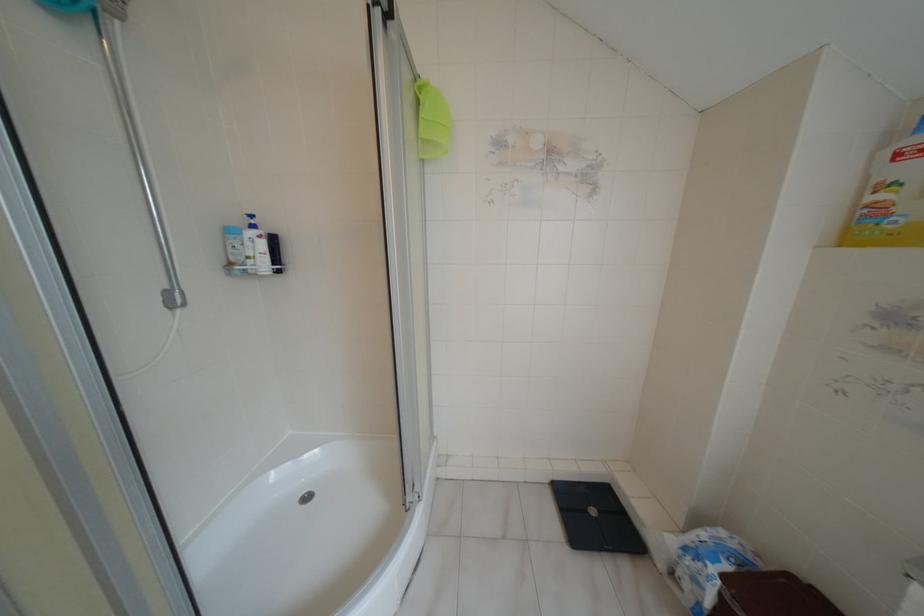
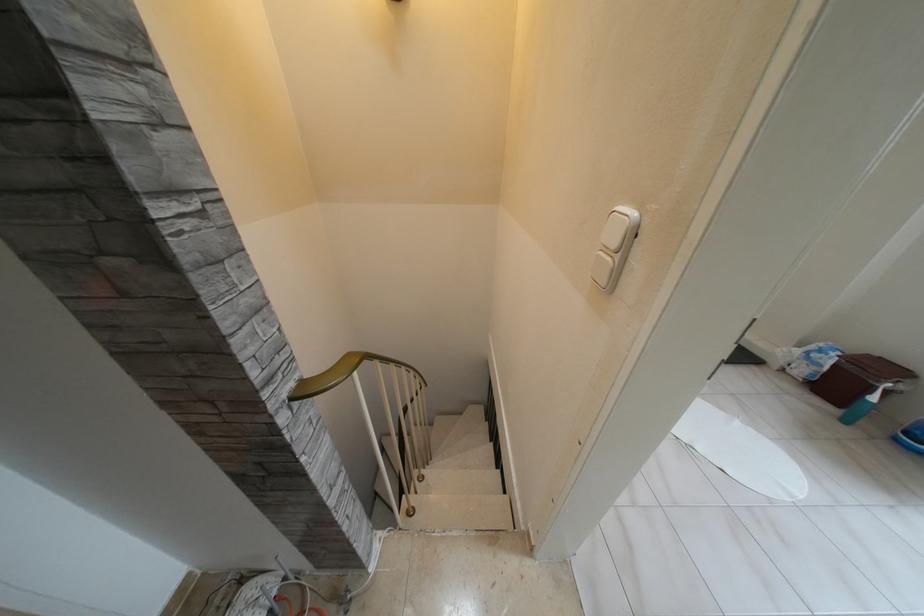
Question: In a continuous first-person perspective shot, in which direction is the camera moving?

Choices:
 (A) Left
 (B) Right
 (C) Forward
 (D) Backward

Answer: (A)